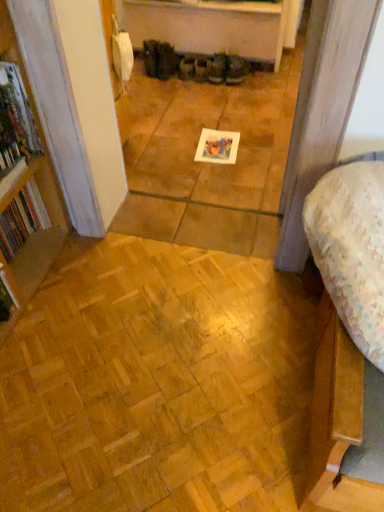
The image size is (384, 512). What do you see at coordinates (22, 219) in the screenshot? I see `hardcover book at left, the second book from the front` at bounding box center [22, 219].

What do you see at coordinates (157, 383) in the screenshot?
I see `natural wood parquet floor at lower left` at bounding box center [157, 383].

The image size is (384, 512). Identify the location of hardcover book at left, arranged as the first book when viewed from the front. (17, 112).

What do you see at coordinates (236, 70) in the screenshot? I see `matte brown boot at center` at bounding box center [236, 70].

Image resolution: width=384 pixels, height=512 pixels. Identify the location of hardcover book at left, the second book from the front. (22, 219).

From the picture: Which object is thinner, hardcover book at left, arranged as the first book when viewed from the front, or floral fabric bed at lower right?

With smaller width is hardcover book at left, arranged as the first book when viewed from the front.

Considering the positions of objects hardcover book at left, arranged as the first book when viewed from the front, and floral fabric bed at lower right in the image provided, who is in front, hardcover book at left, arranged as the first book when viewed from the front, or floral fabric bed at lower right?

floral fabric bed at lower right is more forward.

How distant is hardcover book at left, the second book from the front, from natural wood parquet floor at lower left?

hardcover book at left, the second book from the front, is 24.88 inches away from natural wood parquet floor at lower left.

How different are the orientations of hardcover book at left, the second book from the front, and natural wood parquet floor at lower left in degrees?

The angle between the facing direction of hardcover book at left, the second book from the front, and the facing direction of natural wood parquet floor at lower left is 89.7 degrees.

Based on the photo, is hardcover book at left, the second book from the front, positioned in front of natural wood parquet floor at lower left?

No, it is not.

Between hardcover book at left, which is the first book in back-to-front order, and natural wood parquet floor at lower left, which one appears on the left side from the viewer's perspective?

hardcover book at left, which is the first book in back-to-front order, is more to the left.

In the scene shown: From a real-world perspective, is floral fabric bed at lower right on hardcover book at left, arranged as the first book when viewed from the front?

Actually, floral fabric bed at lower right is physically below hardcover book at left, arranged as the first book when viewed from the front, in the real world.

Where is `book that is the 2nd object located above the floral fabric bed at lower right (from the image's perspective)`? The height and width of the screenshot is (512, 384). book that is the 2nd object located above the floral fabric bed at lower right (from the image's perspective) is located at coordinates (17, 112).

Do you think floral fabric bed at lower right is within hardcover book at left, arranged as the first book when viewed from the front, or outside of it?

The correct answer is: outside.

Looking at this image, does floral fabric bed at lower right have a greater width compared to matte brown boot at center?

Yes, floral fabric bed at lower right is wider than matte brown boot at center.

From a real-world perspective, is floral fabric bed at lower right above or below matte brown boot at center?

From a real-world perspective, floral fabric bed at lower right is physically above matte brown boot at center.

Can you tell me how much floral fabric bed at lower right and matte brown boot at center differ in facing direction?

The angular difference between floral fabric bed at lower right and matte brown boot at center is 18.6 degrees.

Could you tell me if floral fabric bed at lower right is turned towards matte brown boot at center?

No, floral fabric bed at lower right is not oriented towards matte brown boot at center.

Can hardcover book at left, which is the first book in back-to-front order, be found inside natural wood parquet floor at lower left?

No.

How much distance is there between natural wood parquet floor at lower left and hardcover book at left, which is the first book in back-to-front order?

natural wood parquet floor at lower left and hardcover book at left, which is the first book in back-to-front order, are 24.88 inches apart from each other.

Is natural wood parquet floor at lower left turned away from hardcover book at left, which is the first book in back-to-front order?

No.

From a real-world perspective, who is located lower, natural wood parquet floor at lower left or hardcover book at left, the second book from the front?

natural wood parquet floor at lower left.

From a real-world perspective, which object rests below the other?

In real-world perspective, natural wood parquet floor at lower left is lower.

This screenshot has height=512, width=384. I want to click on bed on the right of natural wood parquet floor at lower left, so click(x=344, y=422).

Is natural wood parquet floor at lower left beside floral fabric bed at lower right?

No, natural wood parquet floor at lower left is not next to floral fabric bed at lower right.

From a real-world perspective, is matte brown boot at center physically above natural wood parquet floor at lower left?

Yes, from a real-world perspective, matte brown boot at center is above natural wood parquet floor at lower left.

Looking at the image, does matte brown boot at center seem bigger or smaller compared to natural wood parquet floor at lower left?

Result: matte brown boot at center is smaller than natural wood parquet floor at lower left.

Based on the photo, between matte brown boot at center and natural wood parquet floor at lower left, which one is positioned in front?

natural wood parquet floor at lower left is in front.

You are a GUI agent. You are given a task and a screenshot of the screen. Output one action in this format:
    pyautogui.click(x=<x>, y=<y>)
    Task: Click on the bed below the hardcover book at left, which ranks as the second book in back-to-front order (from a real-world perspective)
    
    Given the screenshot: What is the action you would take?
    click(344, 422)

This screenshot has height=512, width=384. In order to click on plywood in front of the hardcover book at left, the second book from the front in this screenshot , I will do `click(157, 383)`.

When comparing their distances from hardcover book at left, which ranks as the second book in back-to-front order, does floral fabric bed at lower right or natural wood parquet floor at lower left seem closer?

Based on the image, natural wood parquet floor at lower left appears to be nearer to hardcover book at left, which ranks as the second book in back-to-front order.

Looking at the image, which one is located closer to hardcover book at left, which ranks as the second book in back-to-front order, hardcover book at left, the second book from the front, or matte brown boot at center?

Based on the image, hardcover book at left, the second book from the front, appears to be nearer to hardcover book at left, which ranks as the second book in back-to-front order.

From the image, which object appears to be farther from natural wood parquet floor at lower left, hardcover book at left, which ranks as the second book in back-to-front order, or floral fabric bed at lower right?

hardcover book at left, which ranks as the second book in back-to-front order, is positioned further to the anchor natural wood parquet floor at lower left.

Consider the image. Based on their spatial positions, is natural wood parquet floor at lower left or matte brown boot at center further from floral fabric bed at lower right?

matte brown boot at center is positioned further to the anchor floral fabric bed at lower right.

Looking at the image, which one is located further to matte brown boot at center, hardcover book at left, which is the first book in back-to-front order, or floral fabric bed at lower right?

→ Among the two, floral fabric bed at lower right is located further to matte brown boot at center.

Considering their positions, is matte brown boot at center positioned closer to hardcover book at left, which is the first book in back-to-front order, than natural wood parquet floor at lower left?

The object closer to hardcover book at left, which is the first book in back-to-front order, is natural wood parquet floor at lower left.

Looking at the image, which one is located further to natural wood parquet floor at lower left, hardcover book at left, which is the first book in back-to-front order, or hardcover book at left, arranged as the first book when viewed from the front?

The object further to natural wood parquet floor at lower left is hardcover book at left, arranged as the first book when viewed from the front.

Which object lies further to the anchor point hardcover book at left, arranged as the first book when viewed from the front, hardcover book at left, the second book from the front, or natural wood parquet floor at lower left?

Based on the image, natural wood parquet floor at lower left appears to be further to hardcover book at left, arranged as the first book when viewed from the front.

Image resolution: width=384 pixels, height=512 pixels. What are the coordinates of `book situated between hardcover book at left, the second book from the front, and floral fabric bed at lower right from left to right` in the screenshot? It's located at 17,112.

Locate an element on the screen. book between hardcover book at left, which ranks as the second book in back-to-front order, and matte brown boot at center from front to back is located at coordinates pyautogui.click(x=22, y=219).

The height and width of the screenshot is (512, 384). Identify the location of plywood located between hardcover book at left, which ranks as the second book in back-to-front order, and floral fabric bed at lower right in the left-right direction. (157, 383).

What are the coordinates of `plywood between floral fabric bed at lower right and matte brown boot at center in the front-back direction` in the screenshot? It's located at tap(157, 383).